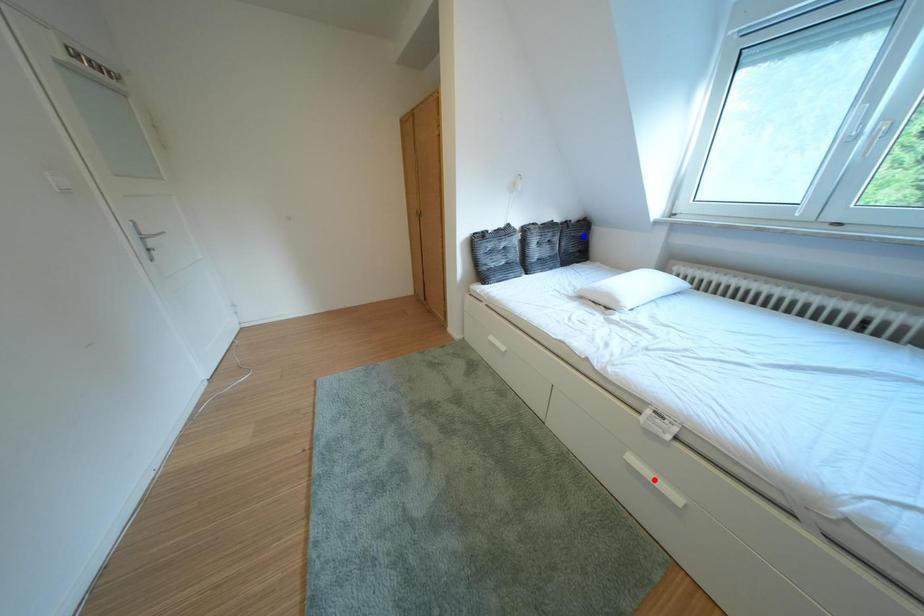
Question: Which of the two points in the image is closer to the camera?

Choices:
 (A) Blue point is closer.
 (B) Red point is closer.

Answer: (B)